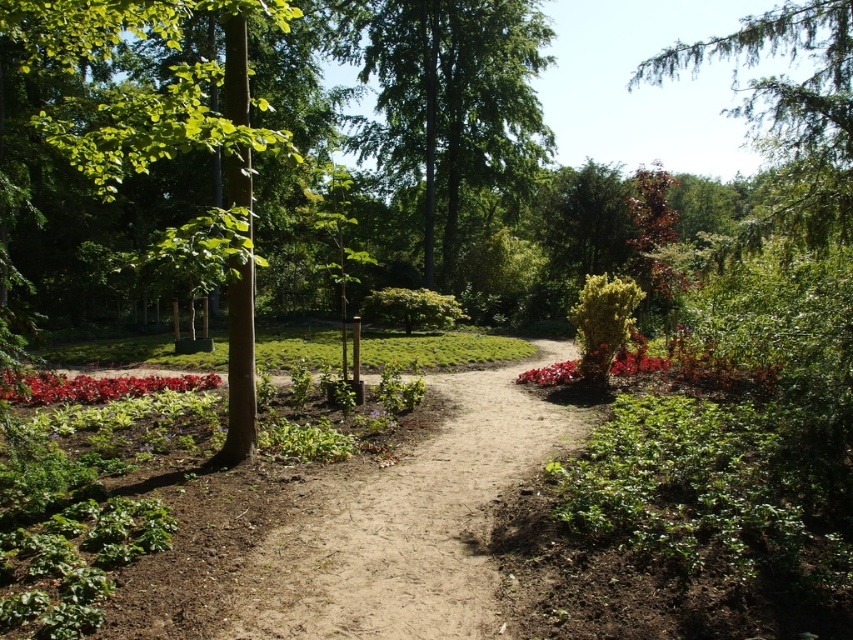
You are a gardener planning to install a new sprinkler system in the garden. The sprinkler has a maximum range of 12 meters. If you position the sprinkler at the green leafy bush at center, will it be able to water the red matte flower bed at lower left?

The red matte flower bed at lower left and green leafy bush at center are 11.92 meters apart. Since the sprinkler has a maximum range of 12 meters, it can reach the red matte flower bed at lower left when positioned at the green leafy bush at center.